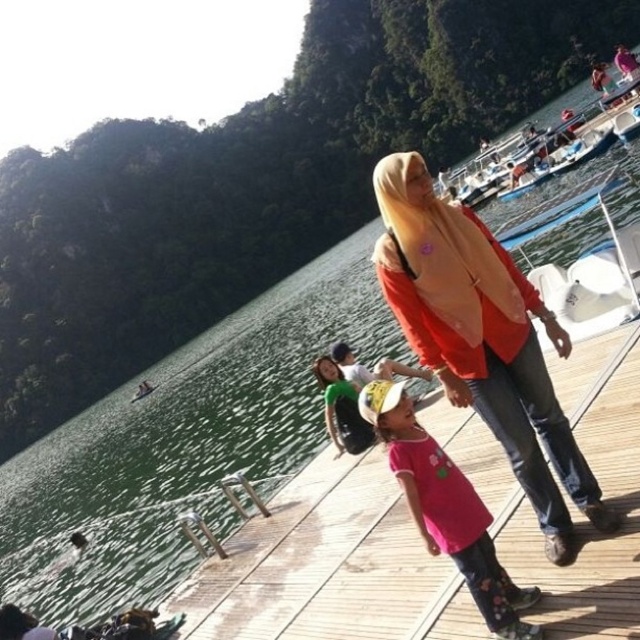
Can you confirm if pink matte t-shirt at center is wider than white cotton shirt at center?

Correct, the width of pink matte t-shirt at center exceeds that of white cotton shirt at center.

Is pink matte t-shirt at center closer to camera compared to white cotton shirt at center?

Yes, it is in front of white cotton shirt at center.

Image resolution: width=640 pixels, height=640 pixels. Describe the element at coordinates (445, 509) in the screenshot. I see `pink matte t-shirt at center` at that location.

You are a GUI agent. You are given a task and a screenshot of the screen. Output one action in this format:
    pyautogui.click(x=<x>, y=<y>)
    Task: Click on the pink matte t-shirt at center
    The height and width of the screenshot is (640, 640).
    Given the screenshot: What is the action you would take?
    pyautogui.click(x=445, y=509)

Does matte orange sweater at center have a lesser height compared to pink matte t-shirt at center?

Incorrect, matte orange sweater at center's height does not fall short of pink matte t-shirt at center's.

Who is taller, matte orange sweater at center or pink matte t-shirt at center?

With more height is matte orange sweater at center.

Which is in front, point (573, 452) or point (412, 516)?

Point (412, 516)

Find the location of a particular element. The width and height of the screenshot is (640, 640). matte orange sweater at center is located at coordinates (483, 339).

Does matte orange sweater at center have a lesser width compared to white cotton shirt at center?

No.

The height and width of the screenshot is (640, 640). What do you see at coordinates (483, 339) in the screenshot?
I see `matte orange sweater at center` at bounding box center [483, 339].

At what (x,y) coordinates should I click in order to perform the action: click on matte orange sweater at center. Please return your answer as a coordinate pair (x, y). Looking at the image, I should click on (483, 339).